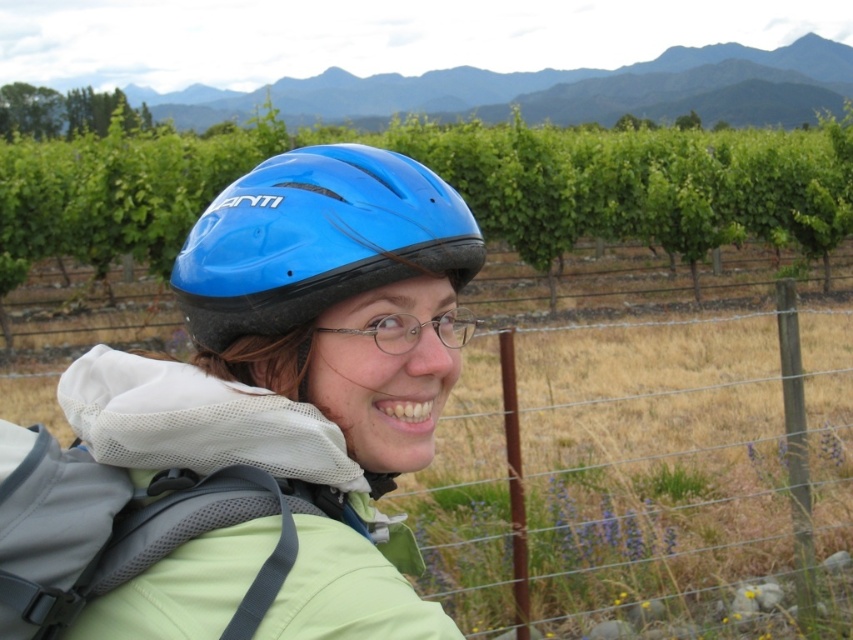
How distant is blue matte bicycle helmet at center from clear plastic glasses at center?

blue matte bicycle helmet at center is 4.60 inches away from clear plastic glasses at center.

Is blue matte bicycle helmet at center smaller than clear plastic glasses at center?

No.

Is point (439, 266) farther from viewer compared to point (437, 323)?

No, it is in front of (437, 323).

The image size is (853, 640). I want to click on blue matte bicycle helmet at center, so 317,240.

Which of these two, wire mesh fence at center or clear plastic glasses at center, stands shorter?

Standing shorter between the two is clear plastic glasses at center.

This screenshot has height=640, width=853. In order to click on wire mesh fence at center in this screenshot , I will do `click(642, 477)`.

This screenshot has width=853, height=640. In order to click on wire mesh fence at center in this screenshot , I will do `click(642, 477)`.

Is blue matte helmet at center shorter than blue matte bicycle helmet at center?

No, blue matte helmet at center is not shorter than blue matte bicycle helmet at center.

Can you confirm if blue matte helmet at center is thinner than blue matte bicycle helmet at center?

Incorrect, blue matte helmet at center's width is not less than blue matte bicycle helmet at center's.

Is point (350, 280) positioned in front of point (247, 232)?

Yes, it is in front of point (247, 232).

The height and width of the screenshot is (640, 853). Identify the location of blue matte helmet at center. (305, 369).